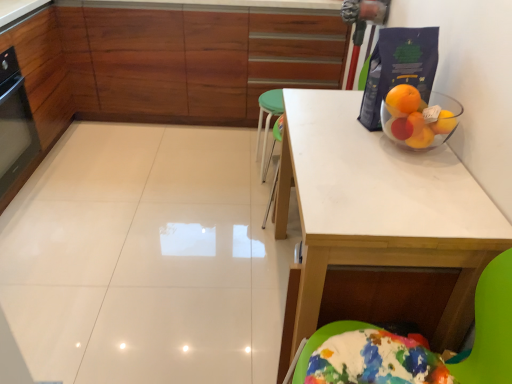
I want to click on wooden cabinet at upper center, so click(168, 62).

Describe the element at coordinates (14, 126) in the screenshot. The height and width of the screenshot is (384, 512). I see `black glass oven at left` at that location.

At what (x,y) coordinates should I click in order to perform the action: click on wooden cabinet at upper center. Please return your answer as a coordinate pair (x, y). The height and width of the screenshot is (384, 512). Looking at the image, I should click on (168, 62).

Which object is closer to the camera, black glass oven at left or white matte table at upper right?

Positioned in front is white matte table at upper right.

What's the angular difference between black glass oven at left and white matte table at upper right's facing directions?

There is a 179-degree angle between the facing directions of black glass oven at left and white matte table at upper right.

Based on the photo, does black glass oven at left contain white matte table at upper right?

No, white matte table at upper right is located outside of black glass oven at left.

Considering the relative sizes of black glass oven at left and white matte table at upper right in the image provided, is black glass oven at left thinner than white matte table at upper right?

Yes, black glass oven at left is thinner than white matte table at upper right.

How many degrees apart are the facing directions of wooden cabinet at upper center and white matte table at upper right?

They differ by 89.5 degrees in their facing directions.

Is wooden cabinet at upper center taller or shorter than white matte table at upper right?

Clearly, wooden cabinet at upper center is taller compared to white matte table at upper right.

Based on the photo, would you say wooden cabinet at upper center is to the left or to the right of white matte table at upper right in the picture?

In the image, wooden cabinet at upper center appears on the left side of white matte table at upper right.

Which point is more distant from viewer, (251, 23) or (443, 185)?

Point (251, 23)

Is point (437, 235) positioned in front of point (295, 79)?

Yes, it is in front of point (295, 79).

Is wooden cabinet at upper center located within white matte table at upper right?

No.

Considering the sizes of objects white matte table at upper right and wooden cabinet at upper center in the image provided, who is shorter, white matte table at upper right or wooden cabinet at upper center?

Standing shorter between the two is white matte table at upper right.

Where is `table that appears below the wooden cabinet at upper center (from a real-world perspective)`? table that appears below the wooden cabinet at upper center (from a real-world perspective) is located at coordinates (379, 207).

In the scene shown: Who is smaller, black glass oven at left or wooden cabinet at upper center?

black glass oven at left is smaller.

Does black glass oven at left appear on the left side of wooden cabinet at upper center?

Indeed, black glass oven at left is positioned on the left side of wooden cabinet at upper center.

From the picture: Would you say wooden cabinet at upper center is part of black glass oven at left's contents?

Actually, wooden cabinet at upper center is outside black glass oven at left.

Is black glass oven at left facing towards wooden cabinet at upper center?

Yes, black glass oven at left is facing wooden cabinet at upper center.

Is white matte table at upper right positioned in front of black glass oven at left?

Yes, white matte table at upper right is closer to the camera.

Can you confirm if white matte table at upper right is wider than black glass oven at left?

Correct, the width of white matte table at upper right exceeds that of black glass oven at left.

I want to click on appliance above the white matte table at upper right (from a real-world perspective), so click(x=14, y=126).

Looking at the image, does white matte table at upper right seem bigger or smaller compared to black glass oven at left?

white matte table at upper right is bigger than black glass oven at left.

Is wooden cabinet at upper center not near black glass oven at left?

No.

Is wooden cabinet at upper center taller than black glass oven at left?

Correct, wooden cabinet at upper center is much taller as black glass oven at left.

Does wooden cabinet at upper center have a greater width compared to black glass oven at left?

Correct, the width of wooden cabinet at upper center exceeds that of black glass oven at left.

Can you confirm if wooden cabinet at upper center is smaller than black glass oven at left?

Actually, wooden cabinet at upper center might be larger than black glass oven at left.

I want to click on appliance behind the white matte table at upper right, so (x=14, y=126).

At what (x,y) coordinates should I click in order to perform the action: click on table below the wooden cabinet at upper center (from the image's perspective). Please return your answer as a coordinate pair (x, y). Looking at the image, I should click on (379, 207).

Looking at the image, which one is located further to black glass oven at left, white matte table at upper right or wooden cabinet at upper center?

white matte table at upper right is positioned further to the anchor black glass oven at left.

Estimate the real-world distances between objects in this image. Which object is closer to wooden cabinet at upper center, black glass oven at left or white matte table at upper right?

black glass oven at left is positioned closer to the anchor wooden cabinet at upper center.

When comparing their distances from white matte table at upper right, does black glass oven at left or wooden cabinet at upper center seem further?

black glass oven at left is positioned further to the anchor white matte table at upper right.

Based on their spatial positions, is white matte table at upper right or black glass oven at left closer to wooden cabinet at upper center?

Among the two, black glass oven at left is located nearer to wooden cabinet at upper center.

Considering their positions, is wooden cabinet at upper center positioned further to black glass oven at left than white matte table at upper right?

Among the two, white matte table at upper right is located further to black glass oven at left.

Looking at the image, which one is located closer to white matte table at upper right, wooden cabinet at upper center or black glass oven at left?

Based on the image, wooden cabinet at upper center appears to be nearer to white matte table at upper right.

I want to click on cabinetry between black glass oven at left and white matte table at upper right in the horizontal direction, so pyautogui.click(x=168, y=62).